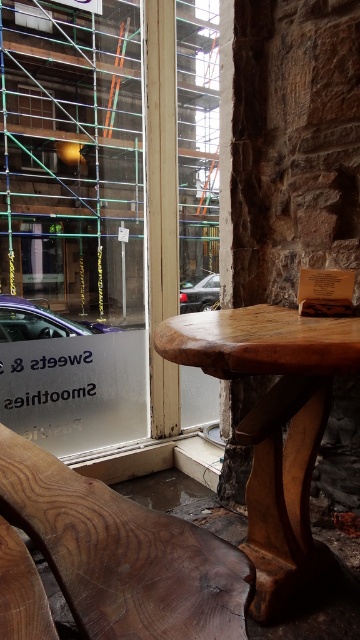
Question: Considering the real-world distances, which object is closest to the wooden chair at lower left?

Choices:
 (A) transparent glass door at left
 (B) smooth wood table at center

Answer: (B)

Question: Which of the following is the farthest from the observer?

Choices:
 (A) (214, 588)
 (B) (93, 419)

Answer: (B)

Question: Where is transparent glass door at left located in relation to wooden chair at lower left in the image?

Choices:
 (A) below
 (B) above

Answer: (B)

Question: Can you confirm if wooden chair at lower left is positioned to the right of smooth wood table at center?

Choices:
 (A) yes
 (B) no

Answer: (B)

Question: Which object appears closest to the camera in this image?

Choices:
 (A) smooth wood table at center
 (B) wooden chair at lower left
 (C) transparent glass door at left

Answer: (B)

Question: Is transparent glass door at left to the left of wooden chair at lower left from the viewer's perspective?

Choices:
 (A) yes
 (B) no

Answer: (A)